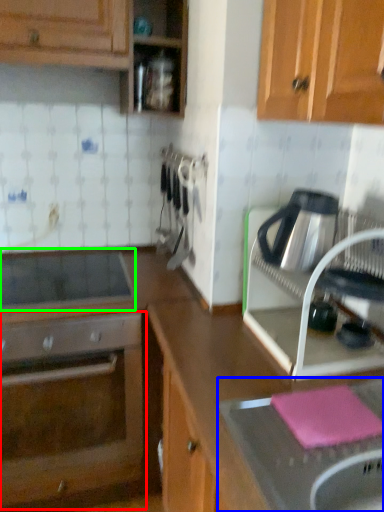
Question: Which object is positioned closest to oven (highlighted by a red box)? Select from sink (highlighted by a blue box) and home appliance (highlighted by a green box).

Choices:
 (A) sink
 (B) home appliance

Answer: (B)